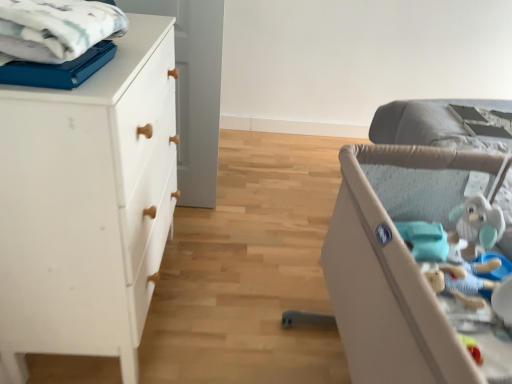
Question: Looking at the image, does white cotton blanket at upper left seem bigger or smaller compared to white matte chest of drawers at left?

Choices:
 (A) big
 (B) small

Answer: (B)

Question: From the image's perspective, is white cotton blanket at upper left above or below white matte chest of drawers at left?

Choices:
 (A) above
 (B) below

Answer: (A)

Question: Estimate the real-world distances between objects in this image. Which object is closer to the beige fabric infant bed at right?

Choices:
 (A) white cotton blanket at upper left
 (B) white matte chest of drawers at left

Answer: (B)

Question: Which is farther from the white cotton blanket at upper left?

Choices:
 (A) white matte chest of drawers at left
 (B) beige fabric infant bed at right

Answer: (B)